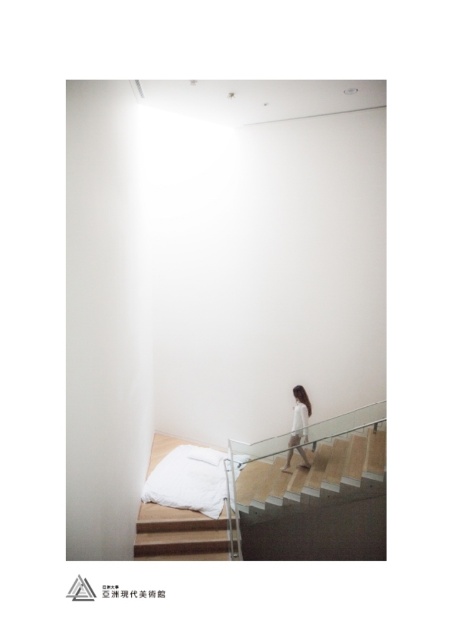
Question: Among these objects, which one is farthest from the camera?

Choices:
 (A) white soft pillow at lower center
 (B) wooden stair at lower center
 (C) wooden staircase at center
 (D) white matte dress at center

Answer: (D)

Question: Does wooden staircase at center have a lesser width compared to white soft pillow at lower center?

Choices:
 (A) yes
 (B) no

Answer: (B)

Question: Does wooden staircase at center have a lesser width compared to wooden stair at lower center?

Choices:
 (A) no
 (B) yes

Answer: (A)

Question: Does wooden stair at lower center have a larger size compared to white matte dress at center?

Choices:
 (A) yes
 (B) no

Answer: (A)

Question: Which is nearer to the white soft pillow at lower center?

Choices:
 (A) wooden staircase at center
 (B) white matte dress at center
 (C) wooden stair at lower center

Answer: (C)

Question: Which object appears closest to the camera in this image?

Choices:
 (A) white soft pillow at lower center
 (B) wooden staircase at center
 (C) wooden stair at lower center
 (D) white matte dress at center

Answer: (B)